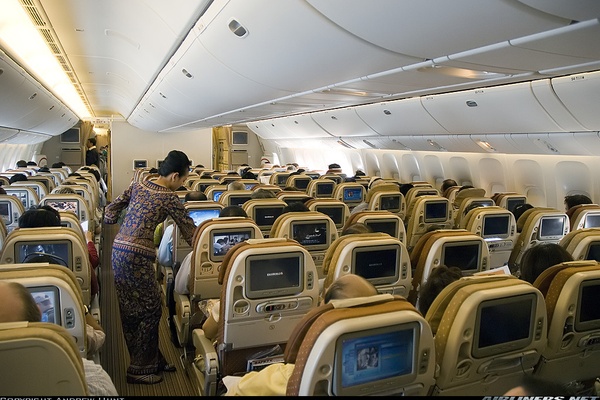
Locate an element on the screen. The height and width of the screenshot is (400, 600). tray tables is located at coordinates (272, 327), (210, 290), (490, 383), (496, 252).